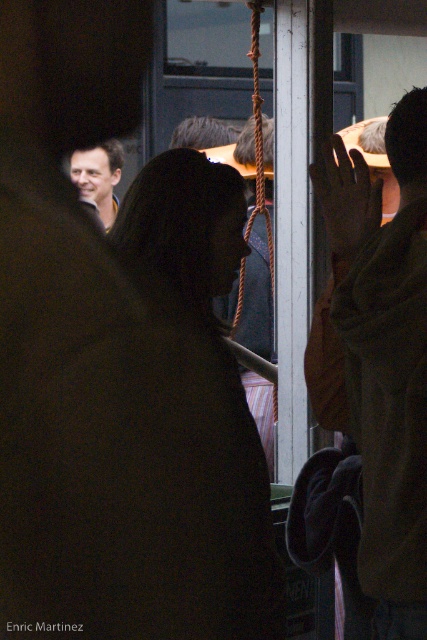
You are a tailor who needs to determine which garment requires more fabric for alterations. Based on the image, which garment has a greater width between the black matte coat at center and the brown fuzzy jacket at right?

The black matte coat at center has a greater width than the brown fuzzy jacket at right, so it would require more fabric for alterations.

You are a photographer trying to capture a clear shot of both the brown fuzzy jacket at right and the matte black jacket at upper left. Which jacket will appear larger in your photo?

The brown fuzzy jacket at right will appear larger in the photo because it is closer to the viewer than the matte black jacket at upper left.

You are a photographer trying to capture a photo of the matte black jacket at upper left without including the brown fuzzy jacket at right in the frame. Based on their positions, is this possible?

The brown fuzzy jacket at right is positioned on the right side of matte black jacket at upper left, so it would be possible to adjust the camera angle to exclude the brown fuzzy jacket at right while focusing on the matte black jacket at upper left.